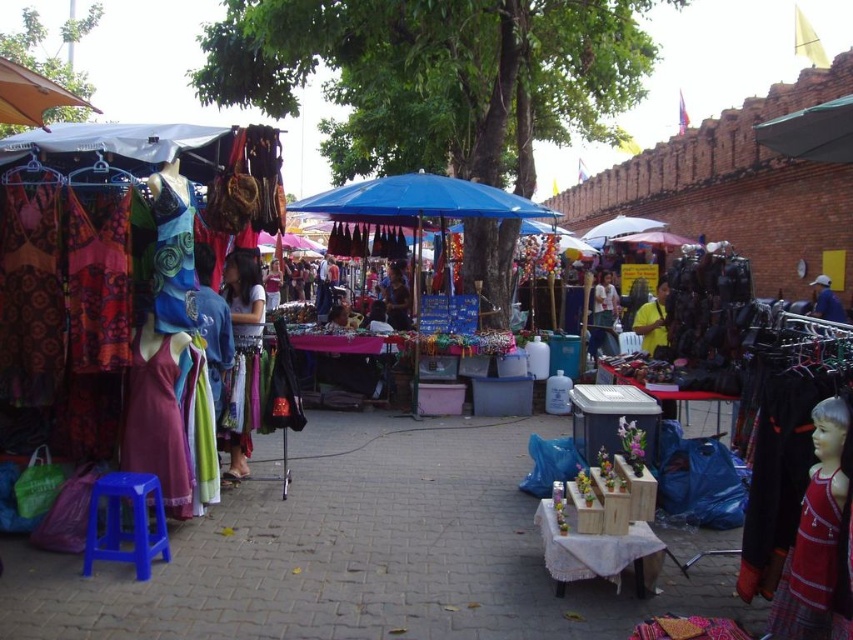
You are a customer at the market and want to pick up the blue fabric umbrella at center and the matte green dress at center. Which item will you reach first if you approach from the front?

The blue fabric umbrella at center is closer to you than the matte green dress at center, so you will reach the blue fabric umbrella at center first.

You are a customer at the market and want to pick up the matte black bag at center and the matte black purse at center. Which one should you reach for first if you want to grab the lower item?

The matte black bag at center is below the matte black purse at center, so you should reach for the matte black bag at center first.